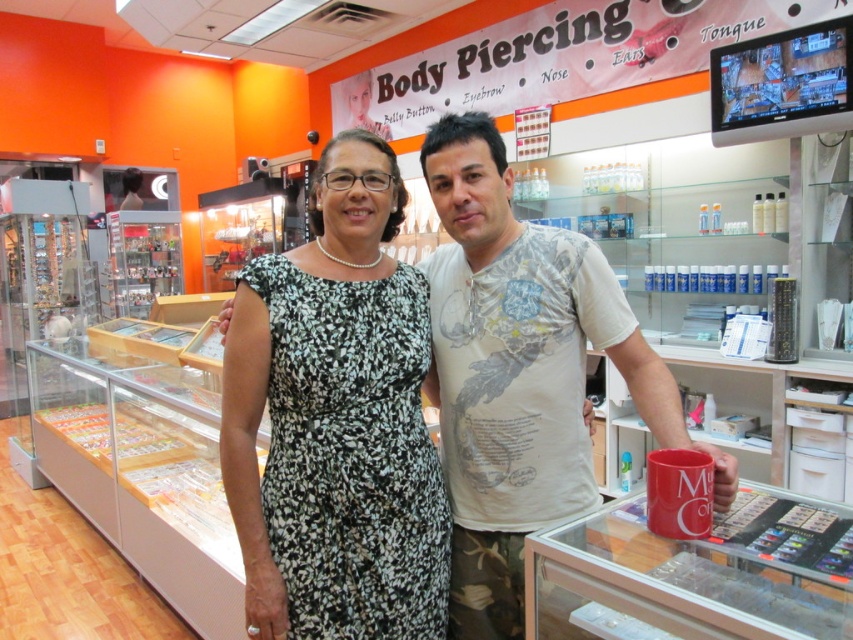
You are standing at point (375, 554) in the body piercing shop. The camera is placed 4.35 feet away from you. If you want to take a photo of the Belly Button piercing sign on the wall, which is located above the shelves, can you do it without moving the camera?

The point (375, 554) is 4.35 feet away from the camera. Since the Belly Button piercing sign is above the shelves, you can take the photo without moving the camera as long as the camera can adjust its angle upwards to capture the sign.